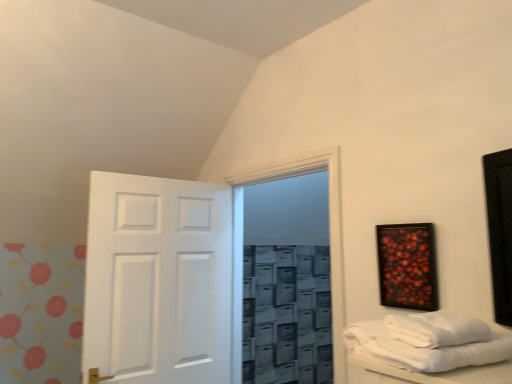
Question: Is white towel at lower right beside wooden-framed artwork at upper right?

Choices:
 (A) yes
 (B) no

Answer: (B)

Question: Does white towel at lower right appear on the left side of wooden-framed artwork at upper right?

Choices:
 (A) no
 (B) yes

Answer: (B)

Question: Is white towel at lower right completely or partially outside of wooden-framed artwork at upper right?

Choices:
 (A) no
 (B) yes

Answer: (B)

Question: Is white towel at lower right to the right of wooden-framed artwork at upper right from the viewer's perspective?

Choices:
 (A) no
 (B) yes

Answer: (A)

Question: Are white towel at lower right and wooden-framed artwork at upper right located far from each other?

Choices:
 (A) yes
 (B) no

Answer: (B)

Question: Considering the positions of wooden-framed artwork at upper right and white towel at lower right in the image, is wooden-framed artwork at upper right wider or thinner than white towel at lower right?

Choices:
 (A) wide
 (B) thin

Answer: (B)

Question: Does point (397, 291) appear closer or farther from the camera than point (434, 337)?

Choices:
 (A) farther
 (B) closer

Answer: (A)

Question: Visually, is wooden-framed artwork at upper right positioned to the left or to the right of white towel at lower right?

Choices:
 (A) left
 (B) right

Answer: (B)

Question: Is wooden-framed artwork at upper right in front of or behind white towel at lower right in the image?

Choices:
 (A) front
 (B) behind

Answer: (B)

Question: Is transparent glass door at center bigger or smaller than white matte door at center?

Choices:
 (A) small
 (B) big

Answer: (B)

Question: Is transparent glass door at center spatially inside white matte door at center, or outside of it?

Choices:
 (A) inside
 (B) outside

Answer: (B)

Question: Is transparent glass door at center wider or thinner than white matte door at center?

Choices:
 (A) thin
 (B) wide

Answer: (B)

Question: From the image's perspective, relative to white matte door at center, is transparent glass door at center above or below?

Choices:
 (A) above
 (B) below

Answer: (A)

Question: Is transparent glass door at center taller or shorter than white cotton towels at right?

Choices:
 (A) short
 (B) tall

Answer: (B)

Question: From the image's perspective, is transparent glass door at center located above or below white cotton towels at right?

Choices:
 (A) above
 (B) below

Answer: (B)